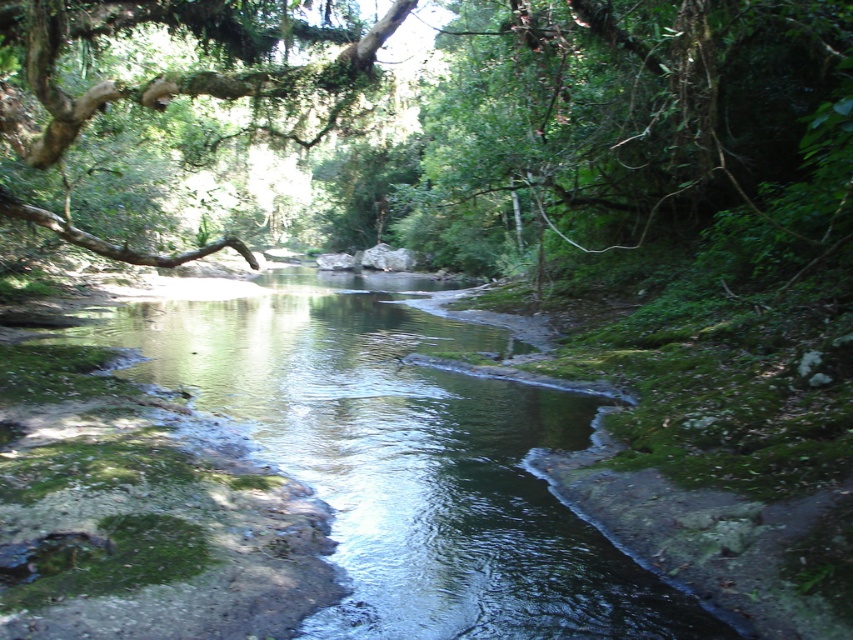
You are standing at the edge of the green mossy river at center and want to reach the green mossy branch at upper left. Which direction should you move to get closer to the branch?

You should move upward to get closer to the green mossy branch at upper left since the green mossy river at center is located below it.

You are standing at the edge of the green mossy river at center and want to reach the green mossy branch at upper left. Which direction should you move to get closer to the branch?

To reach the green mossy branch at upper left from the green mossy river at center, you should move to the left since the river is positioned to the right of the branch.

You are standing at the edge of the stream in the image. There is a point labeled as point (405, 460). What is located at that point?

The point (405, 460) corresponds to the green mossy river at center.